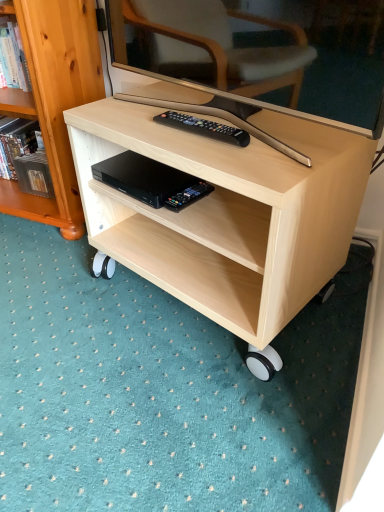
What do you see at coordinates (228, 213) in the screenshot? I see `light wood desk at center` at bounding box center [228, 213].

Find the location of a particular element. light wood desk at center is located at coordinates (228, 213).

Is light wood desk at center situated inside light wood/texture bookcase at left or outside?

light wood desk at center is not enclosed by light wood/texture bookcase at left.

Between light wood desk at center and light wood/texture bookcase at left, which one has smaller size?

With smaller size is light wood desk at center.

Where is `desk below the light wood/texture bookcase at left (from a real-world perspective)`? The width and height of the screenshot is (384, 512). desk below the light wood/texture bookcase at left (from a real-world perspective) is located at coordinates (228, 213).

Is light wood/texture bookcase at left oriented towards black plastic remote control at lower center?

No.

From a real-world perspective, is light wood/texture bookcase at left located beneath black plastic remote control at lower center?

Incorrect, from a real-world perspective, light wood/texture bookcase at left is higher than black plastic remote control at lower center.

In the scene shown: Relative to black plastic remote control at lower center, is light wood/texture bookcase at left in front or behind?

Visually, light wood/texture bookcase at left is located behind black plastic remote control at lower center.

Would you say light wood/texture bookcase at left is to the left or to the right of black plastic remote control at lower center in the picture?

light wood/texture bookcase at left is to the left of black plastic remote control at lower center.

Consider the image. Is black plastic remote at center thinner than light wood desk at center?

Indeed, black plastic remote at center has a lesser width compared to light wood desk at center.

From a real-world perspective, is black plastic remote at center above or below light wood desk at center?

black plastic remote at center is situated higher than light wood desk at center in the real world.

Is black plastic remote at center inside the boundaries of light wood desk at center, or outside?

black plastic remote at center is enclosed within light wood desk at center.

Identify the location of desk that is in front of the black plastic remote at center. This screenshot has height=512, width=384. (228, 213).

Would you say black plastic remote control at lower center is a long distance from black plastic remote at center?

No, black plastic remote control at lower center is in close proximity to black plastic remote at center.

Is black plastic remote control at lower center oriented towards black plastic remote at center?

No, black plastic remote control at lower center is not turned towards black plastic remote at center.

Does black plastic remote control at lower center have a greater width compared to black plastic remote at center?

Correct, the width of black plastic remote control at lower center exceeds that of black plastic remote at center.

Is black plastic remote control at lower center at the right side of black plastic remote at center?

In fact, black plastic remote control at lower center is to the left of black plastic remote at center.

Is black plastic remote at center smaller than black plastic remote control at lower center?

Indeed, black plastic remote at center has a smaller size compared to black plastic remote control at lower center.

From a real-world perspective, which object rests below the other?

black plastic remote control at lower center is physically lower.

Does black plastic remote at center have a greater width compared to black plastic remote control at lower center?

Incorrect, the width of black plastic remote at center does not surpass that of black plastic remote control at lower center.

Is light wood/texture bookcase at left taller than light wood desk at center?

Yes, light wood/texture bookcase at left is taller than light wood desk at center.

Considering the relative positions of light wood/texture bookcase at left and light wood desk at center in the image provided, is light wood/texture bookcase at left to the left or to the right of light wood desk at center?

In the image, light wood/texture bookcase at left appears on the left side of light wood desk at center.

Between light wood/texture bookcase at left and light wood desk at center, which one has smaller width?

light wood/texture bookcase at left is thinner.

Is light wood/texture bookcase at left oriented away from light wood desk at center?

No, light wood desk at center is not at the back of light wood/texture bookcase at left.

Could you tell me if light wood desk at center is facing black plastic remote control at lower center?

Yes, light wood desk at center is facing black plastic remote control at lower center.

From the image's perspective, relative to black plastic remote control at lower center, is light wood desk at center above or below?

light wood desk at center is below black plastic remote control at lower center.

Who is smaller, light wood desk at center or black plastic remote control at lower center?

With smaller size is black plastic remote control at lower center.

In the scene shown: Relative to black plastic remote control at lower center, is light wood desk at center in front or behind?

In the image, light wood desk at center appears in front of black plastic remote control at lower center.

Find the location of a particular element. desk on the right of light wood/texture bookcase at left is located at coordinates (228, 213).

At what (x,y) coordinates should I click in order to perform the action: click on equipment below the light wood/texture bookcase at left (from the image's perspective). Please return your answer as a coordinate pair (x, y). Looking at the image, I should click on (188, 196).

Which object lies further to the anchor point light wood desk at center, black plastic remote at center or black plastic remote control at lower center?

Based on the image, black plastic remote control at lower center appears to be further to light wood desk at center.

Based on their spatial positions, is light wood desk at center or black plastic remote control at lower center further from black plastic remote at center?

Based on the image, light wood desk at center appears to be further to black plastic remote at center.

From the image, which object appears to be nearer to light wood desk at center, black plastic remote at center or light wood/texture bookcase at left?

black plastic remote at center lies closer to light wood desk at center than the other object.

Based on their spatial positions, is black plastic remote control at lower center or light wood desk at center closer to black plastic remote at center?

black plastic remote control at lower center is positioned closer to the anchor black plastic remote at center.

When comparing their distances from black plastic remote control at lower center, does light wood desk at center or black plastic remote at center seem closer?

The object closer to black plastic remote control at lower center is black plastic remote at center.

Consider the image. Which object lies further to the anchor point black plastic remote at center, black plastic remote control at lower center or light wood/texture bookcase at left?

light wood/texture bookcase at left is further to black plastic remote at center.

From the image, which object appears to be nearer to light wood/texture bookcase at left, black plastic remote at center or black plastic remote control at lower center?

black plastic remote at center lies closer to light wood/texture bookcase at left than the other object.

Based on their spatial positions, is light wood/texture bookcase at left or black plastic remote control at lower center further from black plastic remote at center?

light wood/texture bookcase at left.

This screenshot has height=512, width=384. Identify the location of remote control between light wood/texture bookcase at left and light wood desk at center. (204, 128).

At what (x,y) coordinates should I click in order to perform the action: click on remote control between light wood desk at center and black plastic remote control at lower center in the front-back direction. Please return your answer as a coordinate pair (x, y). Looking at the image, I should click on (204, 128).

This screenshot has height=512, width=384. Identify the location of equipment between light wood/texture bookcase at left and black plastic remote at center in the horizontal direction. (188, 196).

This screenshot has width=384, height=512. Find the location of `equipment between light wood/texture bookcase at left and light wood desk at center in the horizontal direction`. equipment between light wood/texture bookcase at left and light wood desk at center in the horizontal direction is located at coordinates (188, 196).